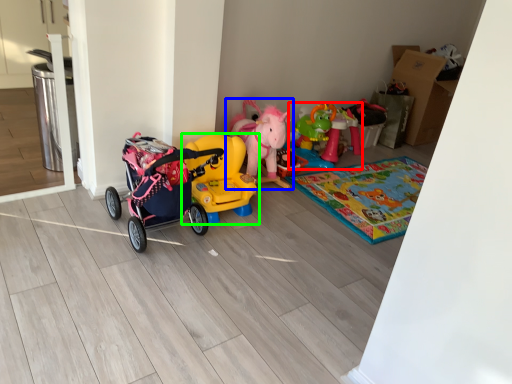
Question: Considering the real-world distances, which object is closest to toy (highlighted by a red box)? toy (highlighted by a blue box) or toy (highlighted by a green box).

Choices:
 (A) toy
 (B) toy

Answer: (A)